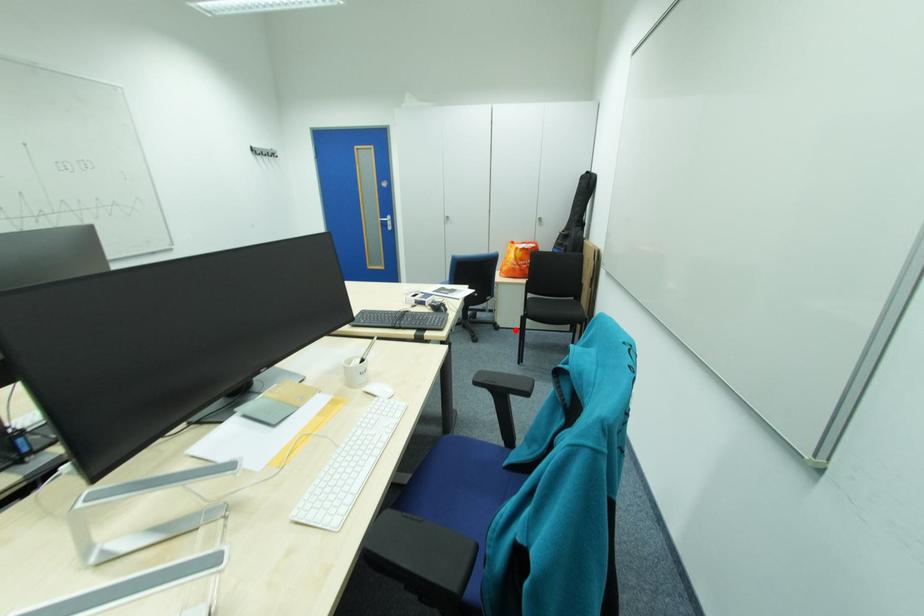
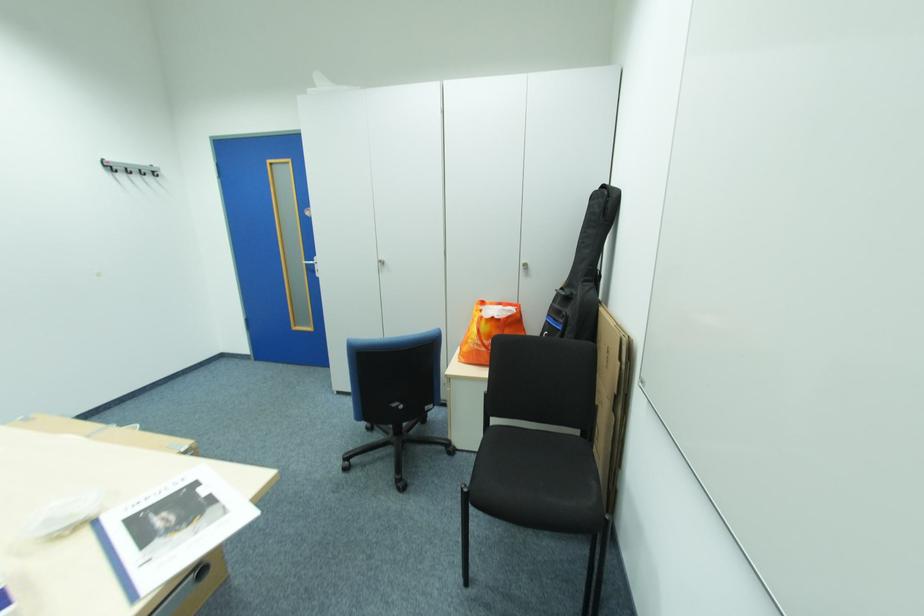
In the second image, find the point that corresponds to the highlighted location in the first image.

(478, 455)